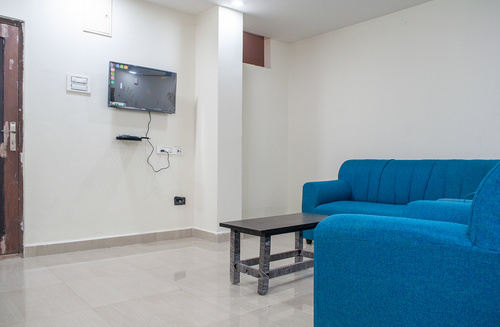
Find the location of `screen`. screen is located at coordinates (145, 89), (142, 143).